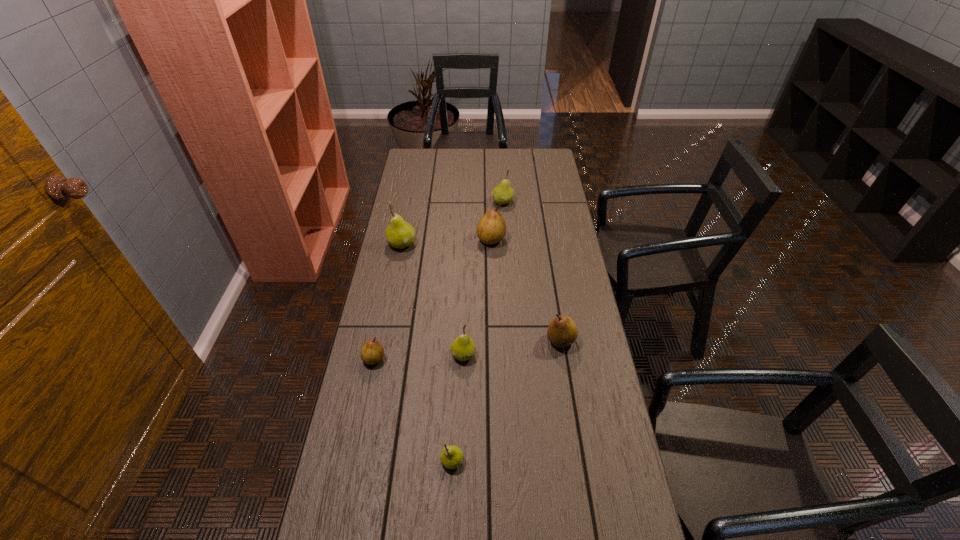
Locate an element on the screen. The height and width of the screenshot is (540, 960). free space in the image that satisfies the following two spatial constraints: 1. on the front side of the farthest brown pear; 2. on the left side of the second smallest brown pear is located at coordinates (493, 340).

This screenshot has height=540, width=960. Identify the location of vacant region that satisfies the following two spatial constraints: 1. on the front side of the nearest pear; 2. on the right side of the leftmost brown pear. (353, 461).

Where is `vacant space that satisfies the following two spatial constraints: 1. on the back side of the tallest pear; 2. on the left side of the farthest object`? The height and width of the screenshot is (540, 960). vacant space that satisfies the following two spatial constraints: 1. on the back side of the tallest pear; 2. on the left side of the farthest object is located at coordinates (410, 202).